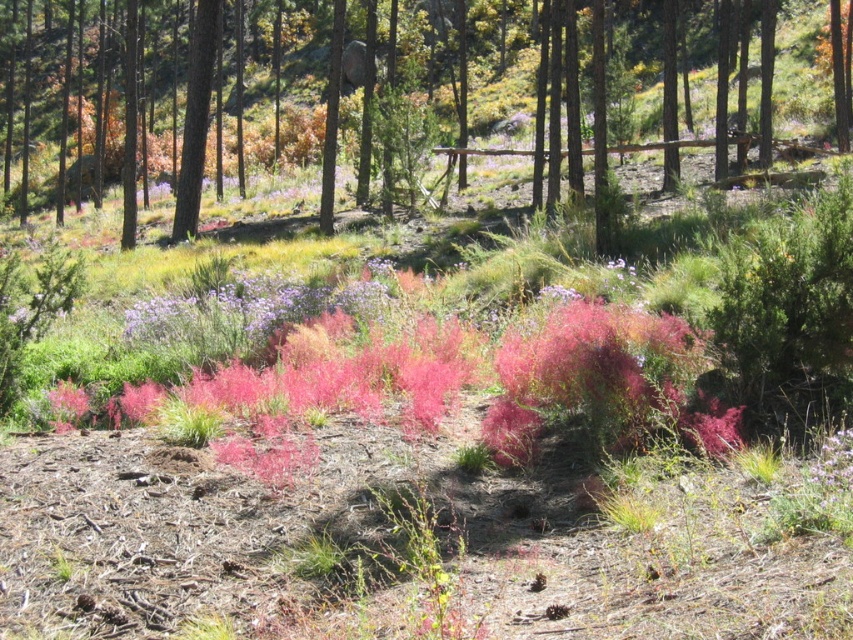
From the picture: You are a hiker who wants to take a photo of the pink fluffy plant at center. However, there is a smooth bark tree at center blocking your view. Can you move the tree to the side to get a clear shot?

The smooth bark tree at center is positioned over the pink fluffy plant at center, so you cannot move the tree to the side to get a clear shot.

You are a hiker who wants to take a photo of both the smooth bark tree at center and the pink fluffy plant at center. Which one should you focus on first if you want to capture both in the same frame without moving your camera?

You should focus on the smooth bark tree at center first because it is to the left of the pink fluffy plant at center, so adjusting the camera to include both would require framing from left to right.

You are standing in the forest clearing and want to locate the smooth bark tree at center. According to the coordinates provided, where exactly is it positioned?

The smooth bark tree at center is positioned at coordinates point (563, 108).